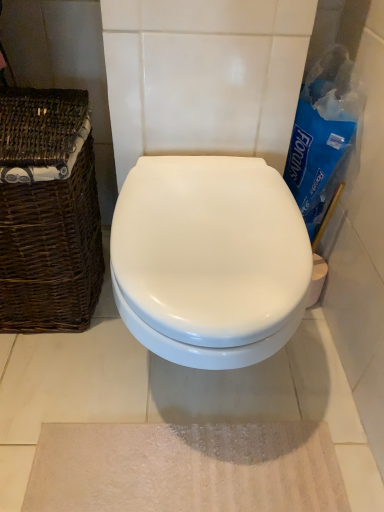
The width and height of the screenshot is (384, 512). I want to click on beige textured bath mat at lower center, so click(185, 468).

This screenshot has height=512, width=384. What do you see at coordinates (209, 259) in the screenshot? I see `white glossy toilet at center` at bounding box center [209, 259].

At what (x,y) coordinates should I click in order to perform the action: click on beige textured bath mat at lower center. Please return your answer as a coordinate pair (x, y). The height and width of the screenshot is (512, 384). Looking at the image, I should click on (185, 468).

Is beige textured bath mat at lower center wider or thinner than brown woven basket at left?

Considering their sizes, beige textured bath mat at lower center looks slimmer than brown woven basket at left.

From a real-world perspective, which is physically above, beige textured bath mat at lower center or brown woven basket at left?

brown woven basket at left is physically above.

Can you tell me how much beige textured bath mat at lower center and brown woven basket at left differ in facing direction?

beige textured bath mat at lower center and brown woven basket at left are facing 0.327 degrees away from each other.

Is beige textured bath mat at lower center next to brown woven basket at left?

There is a gap between beige textured bath mat at lower center and brown woven basket at left.

From a real-world perspective, does white glossy toilet at center sit lower than beige textured bath mat at lower center?

No.

Is point (125, 274) closer or farther from the camera than point (117, 493)?

Point (125, 274) appears to be closer to the viewer than point (117, 493).

From the image's perspective, is white glossy toilet at center located above or below beige textured bath mat at lower center?

Based on their image positions, white glossy toilet at center is located above beige textured bath mat at lower center.

Considering the relative sizes of white glossy toilet at center and beige textured bath mat at lower center in the image provided, is white glossy toilet at center bigger than beige textured bath mat at lower center?

Indeed, white glossy toilet at center has a larger size compared to beige textured bath mat at lower center.

Between brown woven basket at left and white glossy toilet at center, which one appears on the left side from the viewer's perspective?

brown woven basket at left.

From the image's perspective, which is below, brown woven basket at left or white glossy toilet at center?

white glossy toilet at center appears lower in the image.

In terms of width, does brown woven basket at left look wider or thinner when compared to white glossy toilet at center?

Considering their sizes, brown woven basket at left looks slimmer than white glossy toilet at center.

From a real-world perspective, is brown woven basket at left over white glossy toilet at center?

Yes, from a real-world perspective, brown woven basket at left is above white glossy toilet at center.

From the picture: Which of these two, beige textured bath mat at lower center or white glossy toilet at center, is wider?

With larger width is white glossy toilet at center.

How far apart are beige textured bath mat at lower center and white glossy toilet at center?

They are 39.75 centimeters apart.

Is beige textured bath mat at lower center inside the boundaries of white glossy toilet at center, or outside?

beige textured bath mat at lower center is located beyond the bounds of white glossy toilet at center.

Does beige textured bath mat at lower center appear on the right side of white glossy toilet at center?

No, beige textured bath mat at lower center is not to the right of white glossy toilet at center.

Based on the photo, is beige textured bath mat at lower center at the back of brown woven basket at left?

No.

Is brown woven basket at left bigger or smaller than beige textured bath mat at lower center?

brown woven basket at left is bigger than beige textured bath mat at lower center.

Is point (40, 277) more distant than point (99, 448)?

Yes, point (40, 277) is farther from viewer.

From the picture: From a real-world perspective, between brown woven basket at left and beige textured bath mat at lower center, who is vertically lower?

beige textured bath mat at lower center.

Looking at this image, from the image's perspective, between white glossy toilet at center and brown woven basket at left, which one is located above?

brown woven basket at left.

In the scene shown: Which of these two, white glossy toilet at center or brown woven basket at left, stands taller?

With more height is brown woven basket at left.

This screenshot has width=384, height=512. I want to click on toilet to the right of brown woven basket at left, so click(x=209, y=259).

How different are the orientations of white glossy toilet at center and brown woven basket at left in degrees?

The angular difference between white glossy toilet at center and brown woven basket at left is 0.327 degrees.

Identify the location of bath mat below the brown woven basket at left (from a real-world perspective). (185, 468).

In order to click on bath mat behind the white glossy toilet at center in this screenshot , I will do `click(185, 468)`.

Based on their spatial positions, is white glossy toilet at center or brown woven basket at left closer to beige textured bath mat at lower center?

white glossy toilet at center is positioned closer to the anchor beige textured bath mat at lower center.

Which object lies nearer to the anchor point white glossy toilet at center, brown woven basket at left or beige textured bath mat at lower center?

Based on the image, brown woven basket at left appears to be nearer to white glossy toilet at center.

Which object lies further to the anchor point brown woven basket at left, beige textured bath mat at lower center or white glossy toilet at center?

beige textured bath mat at lower center.

In the scene shown: Which object lies nearer to the anchor point white glossy toilet at center, beige textured bath mat at lower center or brown woven basket at left?

Based on the image, brown woven basket at left appears to be nearer to white glossy toilet at center.

When comparing their distances from beige textured bath mat at lower center, does brown woven basket at left or white glossy toilet at center seem further?

brown woven basket at left.

When comparing their distances from brown woven basket at left, does white glossy toilet at center or beige textured bath mat at lower center seem further?

The object further to brown woven basket at left is beige textured bath mat at lower center.

Identify the location of toilet between brown woven basket at left and beige textured bath mat at lower center vertically. (209, 259).